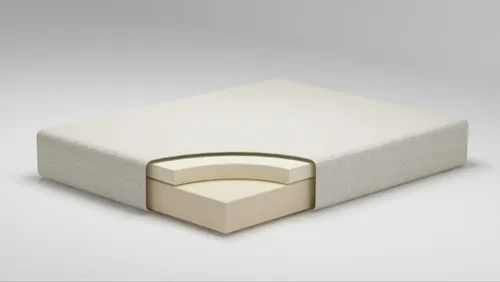
This screenshot has width=500, height=282. Identify the location of table. (493, 212).